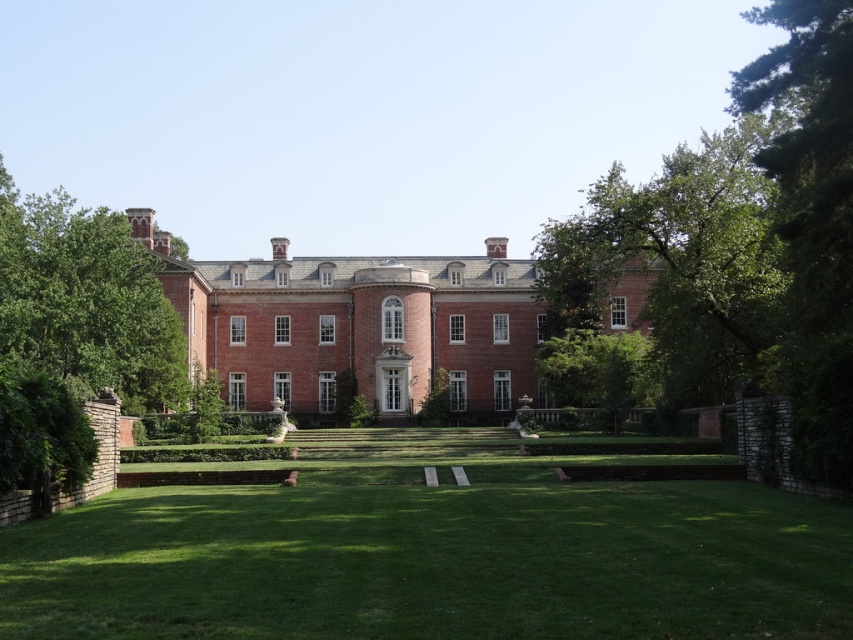
Question: Does green leafy tree at right have a greater width compared to green leafy tree at left?

Choices:
 (A) yes
 (B) no

Answer: (B)

Question: Is brick mansion at center in front of green leafy tree at center-right?

Choices:
 (A) yes
 (B) no

Answer: (A)

Question: Is brick mansion at center to the left of green leafy tree at right from the viewer's perspective?

Choices:
 (A) yes
 (B) no

Answer: (A)

Question: Which point is farther to the camera?

Choices:
 (A) green grass at center
 (B) green leafy tree at left

Answer: (B)

Question: Which point appears farthest from the camera in this image?

Choices:
 (A) (136, 538)
 (B) (428, 321)

Answer: (B)

Question: Based on their relative distances, which object is nearer to the brick mansion at center?

Choices:
 (A) green leafy tree at center-right
 (B) green grass at center

Answer: (A)